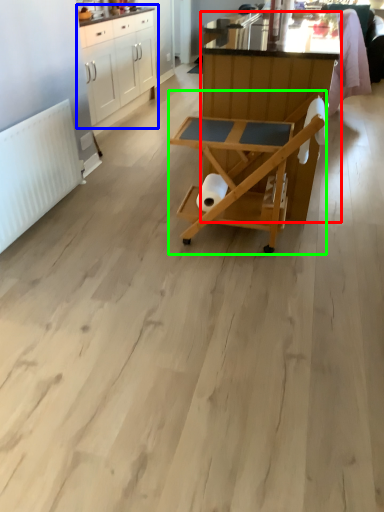
Question: Which is farther away from table (highlighted by a red box)? cabinetry (highlighted by a blue box) or table (highlighted by a green box)?

Choices:
 (A) cabinetry
 (B) table

Answer: (A)